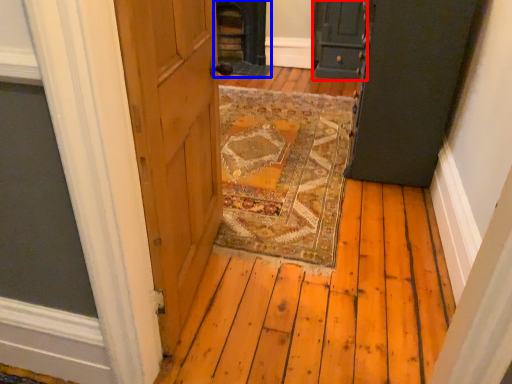
Question: Among these objects, which one is farthest to the camera, door (highlighted by a red box) or fireplace (highlighted by a blue box)?

Choices:
 (A) door
 (B) fireplace

Answer: (B)